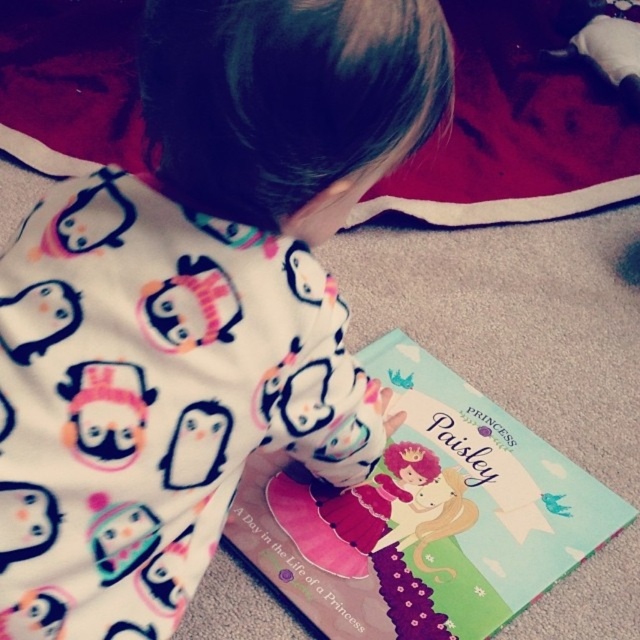
Question: Is white soft pajamas at center wider than matte paper book at center?

Choices:
 (A) no
 (B) yes

Answer: (A)

Question: Considering the relative positions of white soft pajamas at center and matte paper book at center in the image provided, where is white soft pajamas at center located with respect to matte paper book at center?

Choices:
 (A) right
 (B) left

Answer: (B)

Question: Is white soft pajamas at center closer to the viewer compared to matte paper book at center?

Choices:
 (A) yes
 (B) no

Answer: (A)